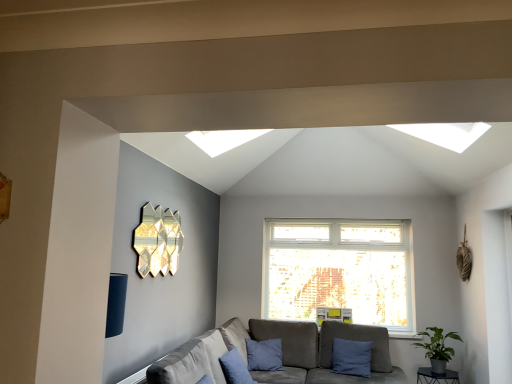
Question: Does blue cotton pillow at lower center, positioned as the first pillow in front-to-back order, have a larger size compared to gold metallic wall art at upper left?

Choices:
 (A) no
 (B) yes

Answer: (B)

Question: Is blue cotton pillow at lower center, positioned as the first pillow in front-to-back order, facing towards gold metallic wall art at upper left?

Choices:
 (A) no
 (B) yes

Answer: (A)

Question: Does blue cotton pillow at lower center, which ranks as the first pillow in left-to-right order, have a smaller size compared to gold metallic wall art at upper left?

Choices:
 (A) no
 (B) yes

Answer: (A)

Question: Can you confirm if blue cotton pillow at lower center, positioned as the first pillow in front-to-back order, is wider than gold metallic wall art at upper left?

Choices:
 (A) yes
 (B) no

Answer: (A)

Question: From the image's perspective, is blue cotton pillow at lower center, positioned as the first pillow in front-to-back order, above gold metallic wall art at upper left?

Choices:
 (A) no
 (B) yes

Answer: (A)

Question: From a real-world perspective, does blue cotton pillow at lower center, positioned as the first pillow in front-to-back order, stand above gold metallic wall art at upper left?

Choices:
 (A) yes
 (B) no

Answer: (B)

Question: Considering the relative sizes of green matte plant at lower right and gray fabric couch at lower center in the image provided, is green matte plant at lower right shorter than gray fabric couch at lower center?

Choices:
 (A) yes
 (B) no

Answer: (A)

Question: Is green matte plant at lower right outside gray fabric couch at lower center?

Choices:
 (A) yes
 (B) no

Answer: (A)

Question: Is gray fabric couch at lower center surrounded by green matte plant at lower right?

Choices:
 (A) no
 (B) yes

Answer: (A)

Question: Would you consider green matte plant at lower right to be distant from gray fabric couch at lower center?

Choices:
 (A) no
 (B) yes

Answer: (A)

Question: Is green matte plant at lower right further to camera compared to gray fabric couch at lower center?

Choices:
 (A) no
 (B) yes

Answer: (B)

Question: From a real-world perspective, is green matte plant at lower right positioned over gray fabric couch at lower center based on gravity?

Choices:
 (A) no
 (B) yes

Answer: (B)

Question: Is green matte plant at lower right thinner than blue fabric pillow at lower right, arranged as the first pillow when viewed from the back?

Choices:
 (A) no
 (B) yes

Answer: (A)